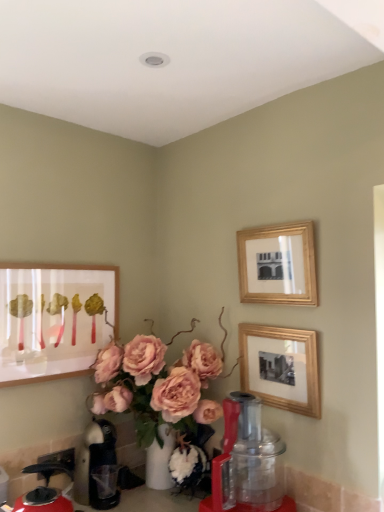
The width and height of the screenshot is (384, 512). Describe the element at coordinates (278, 264) in the screenshot. I see `gold/glass picture frame at upper right, which ranks as the second picture frame in right-to-left order` at that location.

You are a GUI agent. You are given a task and a screenshot of the screen. Output one action in this format:
    pyautogui.click(x=<x>, y=<y>)
    Task: Click on the shiny red coffee pot at lower left, which is the 2th coffeepot in back-to-front order
    
    Given the screenshot: What is the action you would take?
    pyautogui.click(x=44, y=490)

How much space does shiny red coffee pot at lower left, placed as the first coffeepot when sorted from front to back, occupy horizontally?

The width of shiny red coffee pot at lower left, placed as the first coffeepot when sorted from front to back, is 8.92 inches.

The image size is (384, 512). I want to click on pink matte floral arrangement at center, so click(156, 386).

You are a GUI agent. You are given a task and a screenshot of the screen. Output one action in this format:
    pyautogui.click(x=<x>, y=<y>)
    Task: Click on the matte wooden picture frame at left, which is counted as the first picture frame, starting from the left
    The width and height of the screenshot is (384, 512).
    Given the screenshot: What is the action you would take?
    pyautogui.click(x=53, y=319)

Where is `gold/glass picture frame at upper right, which ranks as the second picture frame in right-to-left order`? The image size is (384, 512). gold/glass picture frame at upper right, which ranks as the second picture frame in right-to-left order is located at coordinates (278, 264).

Can you confirm if metallic silver coffee pot at lower left, the 1th coffeepot from the back, is bigger than red plastic blender at lower center?

Incorrect, metallic silver coffee pot at lower left, the 1th coffeepot from the back, is not larger than red plastic blender at lower center.

Based on the photo, is metallic silver coffee pot at lower left, the second coffeepot viewed from the front, located outside red plastic blender at lower center?

Indeed, metallic silver coffee pot at lower left, the second coffeepot viewed from the front, is completely outside red plastic blender at lower center.

From a real-world perspective, which is physically below, metallic silver coffee pot at lower left, the second coffeepot viewed from the front, or red plastic blender at lower center?

metallic silver coffee pot at lower left, the second coffeepot viewed from the front, is physically lower.

Does metallic silver coffee pot at lower left, the 1th coffeepot from the back, come in front of red plastic blender at lower center?

No.

From a real-world perspective, is pink matte floral arrangement at center located higher than metallic silver coffee pot at lower left, the second coffeepot viewed from the front?

Yes, from a real-world perspective, pink matte floral arrangement at center is on top of metallic silver coffee pot at lower left, the second coffeepot viewed from the front.

Does pink matte floral arrangement at center lie behind metallic silver coffee pot at lower left, the second coffeepot viewed from the front?

No, pink matte floral arrangement at center is closer to the camera.

Is there a large distance between pink matte floral arrangement at center and metallic silver coffee pot at lower left, the 1th coffeepot from the back?

They are positioned close to each other.

Considering the points (269, 381) and (25, 500), which point is behind, point (269, 381) or point (25, 500)?

The point (269, 381) is behind.

Considering the sizes of objects wooden picture frame at center-right, which is the third picture frame from left to right, and shiny red coffee pot at lower left, placed as the first coffeepot when sorted from front to back, in the image provided, who is thinner, wooden picture frame at center-right, which is the third picture frame from left to right, or shiny red coffee pot at lower left, placed as the first coffeepot when sorted from front to back,?

Thinner between the two is wooden picture frame at center-right, which is the third picture frame from left to right.

From the image's perspective, would you say wooden picture frame at center-right, which is the third picture frame from left to right, is shown under shiny red coffee pot at lower left, placed as the first coffeepot when sorted from front to back?

No, from the image's perspective, wooden picture frame at center-right, which is the third picture frame from left to right, is not below shiny red coffee pot at lower left, placed as the first coffeepot when sorted from front to back.

Which is more distant, (269, 226) or (175, 386)?

The point (269, 226) is more distant.

Is gold/glass picture frame at upper right, marked as the second picture frame in a left-to-right arrangement, facing away from pink matte floral arrangement at center?

gold/glass picture frame at upper right, marked as the second picture frame in a left-to-right arrangement, is not turned away from pink matte floral arrangement at center.

Considering the relative positions of gold/glass picture frame at upper right, which ranks as the second picture frame in right-to-left order, and pink matte floral arrangement at center in the image provided, is gold/glass picture frame at upper right, which ranks as the second picture frame in right-to-left order, to the right of pink matte floral arrangement at center from the viewer's perspective?

Correct, you'll find gold/glass picture frame at upper right, which ranks as the second picture frame in right-to-left order, to the right of pink matte floral arrangement at center.

Is there a large distance between gold/glass picture frame at upper right, which ranks as the second picture frame in right-to-left order, and pink matte floral arrangement at center?

No, gold/glass picture frame at upper right, which ranks as the second picture frame in right-to-left order, is not far from pink matte floral arrangement at center.

The height and width of the screenshot is (512, 384). What are the coordinates of `picture frame that is the 2nd one when counting downward from the gold/glass picture frame at upper right, which ranks as the second picture frame in right-to-left order (from the image's perspective)` in the screenshot? It's located at (287, 368).

Considering the sizes of wooden picture frame at center-right, which is the third picture frame from left to right, and gold/glass picture frame at upper right, marked as the second picture frame in a left-to-right arrangement, in the image, is wooden picture frame at center-right, which is the third picture frame from left to right, taller or shorter than gold/glass picture frame at upper right, marked as the second picture frame in a left-to-right arrangement,?

Clearly, wooden picture frame at center-right, which is the third picture frame from left to right, is shorter compared to gold/glass picture frame at upper right, marked as the second picture frame in a left-to-right arrangement.

What's the angular difference between wooden picture frame at center-right, which is the third picture frame from left to right, and gold/glass picture frame at upper right, marked as the second picture frame in a left-to-right arrangement,'s facing directions?

They differ by 0.96 degrees in their facing directions.

Considering the points (303, 343) and (283, 262), which point is in front, point (303, 343) or point (283, 262)?

The point (303, 343) is closer.

From the image's perspective, is matte wooden picture frame at left, which ranks as the third picture frame in right-to-left order, on top of wooden picture frame at center-right, which is the 1th picture frame from right to left?

Indeed, from the image's perspective, matte wooden picture frame at left, which ranks as the third picture frame in right-to-left order, is shown above wooden picture frame at center-right, which is the 1th picture frame from right to left.

Is point (2, 346) behind point (264, 384)?

No, (2, 346) is in front of (264, 384).

Is matte wooden picture frame at left, which ranks as the third picture frame in right-to-left order, aimed at wooden picture frame at center-right, which is the third picture frame from left to right?

Yes, matte wooden picture frame at left, which ranks as the third picture frame in right-to-left order, is turned towards wooden picture frame at center-right, which is the third picture frame from left to right.

Are matte wooden picture frame at left, which is counted as the first picture frame, starting from the left, and wooden picture frame at center-right, which is the 1th picture frame from right to left, located far from each other?

No, matte wooden picture frame at left, which is counted as the first picture frame, starting from the left, is not far from wooden picture frame at center-right, which is the 1th picture frame from right to left.

Can you confirm if wooden picture frame at center-right, which is the third picture frame from left to right, is bigger than pink matte floral arrangement at center?

Incorrect, wooden picture frame at center-right, which is the third picture frame from left to right, is not larger than pink matte floral arrangement at center.

How many degrees apart are the facing directions of wooden picture frame at center-right, which is the third picture frame from left to right, and pink matte floral arrangement at center?

1.69 degrees separate the facing orientations of wooden picture frame at center-right, which is the third picture frame from left to right, and pink matte floral arrangement at center.

Which is more to the right, wooden picture frame at center-right, which is the 1th picture frame from right to left, or pink matte floral arrangement at center?

wooden picture frame at center-right, which is the 1th picture frame from right to left.

What are the coordinates of `the 2nd coffeepot behind the red plastic blender at lower center` in the screenshot? It's located at (95, 464).

Identify the location of floral arrangement in front of the metallic silver coffee pot at lower left, the second coffeepot viewed from the front. The width and height of the screenshot is (384, 512). (156, 386).

Based on the photo, when comparing their distances from wooden picture frame at center-right, which is the 1th picture frame from right to left, does matte wooden picture frame at left, which is counted as the first picture frame, starting from the left, or pink matte floral arrangement at center seem further?

The object further to wooden picture frame at center-right, which is the 1th picture frame from right to left, is matte wooden picture frame at left, which is counted as the first picture frame, starting from the left.

From the image, which object appears to be nearer to gold/glass picture frame at upper right, which ranks as the second picture frame in right-to-left order, pink matte floral arrangement at center or red plastic blender at lower center?

pink matte floral arrangement at center.

When comparing their distances from red plastic blender at lower center, does gold/glass picture frame at upper right, marked as the second picture frame in a left-to-right arrangement, or metallic silver coffee pot at lower left, the second coffeepot viewed from the front, seem closer?

The object closer to red plastic blender at lower center is metallic silver coffee pot at lower left, the second coffeepot viewed from the front.

Looking at the image, which one is located closer to matte wooden picture frame at left, which ranks as the third picture frame in right-to-left order, metallic silver coffee pot at lower left, the 1th coffeepot from the back, or wooden picture frame at center-right, which is the 1th picture frame from right to left?

metallic silver coffee pot at lower left, the 1th coffeepot from the back, is positioned closer to the anchor matte wooden picture frame at left, which ranks as the third picture frame in right-to-left order.

Considering their positions, is pink matte floral arrangement at center positioned further to metallic silver coffee pot at lower left, the second coffeepot viewed from the front, than wooden picture frame at center-right, which is the 1th picture frame from right to left?

wooden picture frame at center-right, which is the 1th picture frame from right to left, lies further to metallic silver coffee pot at lower left, the second coffeepot viewed from the front, than the other object.

Looking at the image, which one is located closer to pink matte floral arrangement at center, gold/glass picture frame at upper right, marked as the second picture frame in a left-to-right arrangement, or red plastic blender at lower center?

The object closer to pink matte floral arrangement at center is red plastic blender at lower center.

Considering their positions, is metallic silver coffee pot at lower left, the second coffeepot viewed from the front, positioned further to shiny red coffee pot at lower left, placed as the first coffeepot when sorted from front to back, than gold/glass picture frame at upper right, which ranks as the second picture frame in right-to-left order?

gold/glass picture frame at upper right, which ranks as the second picture frame in right-to-left order, lies further to shiny red coffee pot at lower left, placed as the first coffeepot when sorted from front to back, than the other object.

Looking at this image, based on their spatial positions, is red plastic blender at lower center or wooden picture frame at center-right, which is the third picture frame from left to right, closer to shiny red coffee pot at lower left, placed as the first coffeepot when sorted from front to back?

red plastic blender at lower center lies closer to shiny red coffee pot at lower left, placed as the first coffeepot when sorted from front to back, than the other object.

The width and height of the screenshot is (384, 512). I want to click on floral arrangement that lies between matte wooden picture frame at left, which ranks as the third picture frame in right-to-left order, and metallic silver coffee pot at lower left, the 1th coffeepot from the back, from top to bottom, so click(x=156, y=386).

The image size is (384, 512). Identify the location of blender between shiny red coffee pot at lower left, which is the 2th coffeepot in back-to-front order, and wooden picture frame at center-right, which is the third picture frame from left to right, from left to right. (247, 461).

In order to click on coffeepot between shiny red coffee pot at lower left, placed as the first coffeepot when sorted from front to back, and wooden picture frame at center-right, which is the 1th picture frame from right to left, in the horizontal direction in this screenshot , I will do `click(95, 464)`.

Find the location of a particular element. floral arrangement located between matte wooden picture frame at left, which is counted as the first picture frame, starting from the left, and wooden picture frame at center-right, which is the third picture frame from left to right, in the left-right direction is located at coordinates coord(156,386).